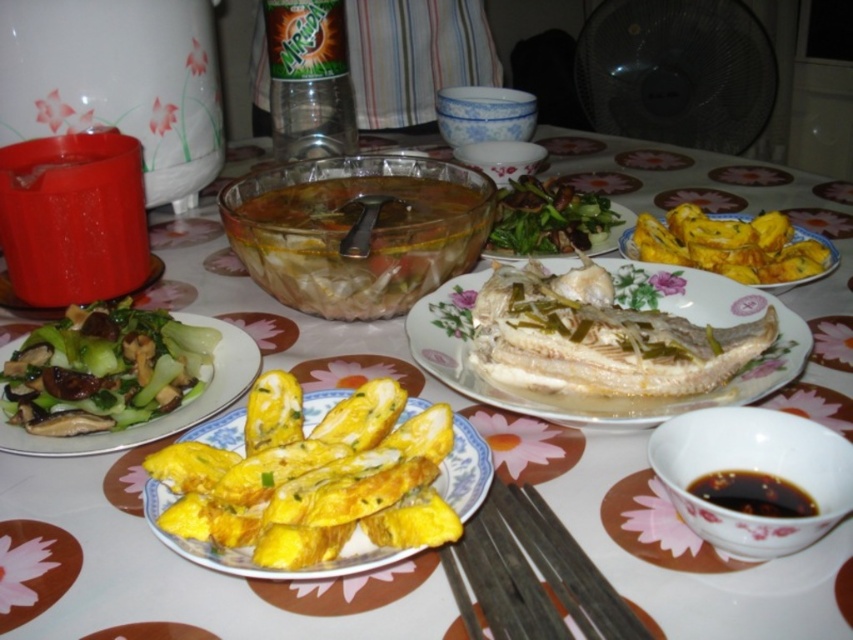
You are a guest at the table and want to pick up the black wood chopsticks at center. If your hand can reach 20 centimeters, will you be able to reach them?

The black wood chopsticks at center are 22.78 centimeters away from the camera, which is beyond your hand reach of 20 centimeters. You will not be able to reach them.

You are sitting at the table and want to reach for the translucent glass bowl at center and the yellow fried pastry at center. Which one is closer to you?

The translucent glass bowl at center is closer to you because it is in front of the yellow fried pastry at center.

What is the spatial relationship between the yellow fried egg at center and the other dishes on the table?

The yellow fried egg at center is positioned at coordinates approximately 0.747 on the x axis and 0.369 on the y axis.